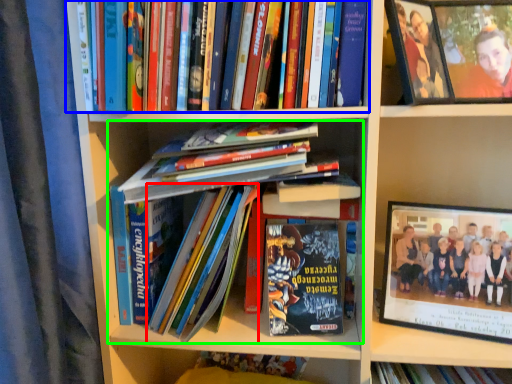
Question: Considering the real-world distances, which object is closest to book (highlighted by a red box)? book (highlighted by a blue box) or book (highlighted by a green box).

Choices:
 (A) book
 (B) book

Answer: (B)